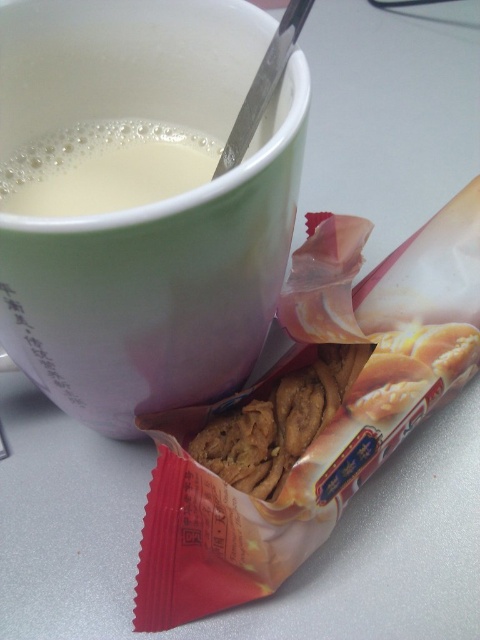
The image size is (480, 640). Describe the element at coordinates (143, 196) in the screenshot. I see `matte ceramic mug at upper center` at that location.

Is matte ceramic mug at upper center thinner than white creamy liquid at upper left?

In fact, matte ceramic mug at upper center might be wider than white creamy liquid at upper left.

Does point (194, 364) come in front of point (157, 132)?

Yes, it is in front of point (157, 132).

This screenshot has height=640, width=480. Find the location of `matte ceramic mug at upper center`. matte ceramic mug at upper center is located at coordinates [x=143, y=196].